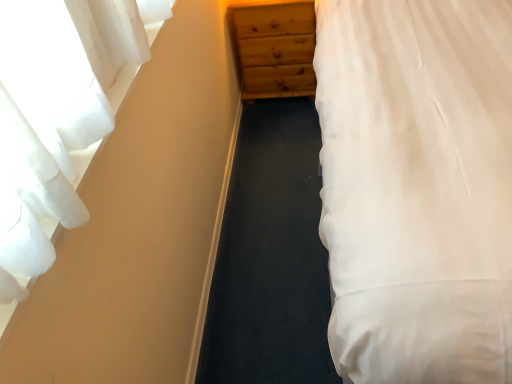
At what (x,y) coordinates should I click in order to perform the action: click on wooden chest of drawers at center. Please return your answer as a coordinate pair (x, y). Looking at the image, I should click on (276, 49).

What do you see at coordinates (417, 188) in the screenshot? I see `white cotton bed at right` at bounding box center [417, 188].

You are a GUI agent. You are given a task and a screenshot of the screen. Output one action in this format:
    pyautogui.click(x=<x>, y=<y>)
    Task: Click on the wooden chest of drawers at center
    The image size is (512, 384).
    Given the screenshot: What is the action you would take?
    pyautogui.click(x=276, y=49)

Which point is more distant from viewer, (287, 54) or (24, 5)?

The point (287, 54) is farther.

Who is bigger, wooden chest of drawers at center or white sheer curtain at left?

With larger size is wooden chest of drawers at center.

Is wooden chest of drawers at center positioned far away from white sheer curtain at left?

Indeed, wooden chest of drawers at center is not near white sheer curtain at left.

Considering the relative sizes of white sheer curtain at left and wooden chest of drawers at center in the image provided, is white sheer curtain at left taller than wooden chest of drawers at center?

No.

Can you confirm if white sheer curtain at left is bigger than wooden chest of drawers at center?

Actually, white sheer curtain at left might be smaller than wooden chest of drawers at center.

From the image's perspective, does white sheer curtain at left appear higher than wooden chest of drawers at center?

No, from the image's perspective, white sheer curtain at left is not on top of wooden chest of drawers at center.

Is white sheer curtain at left positioned far away from wooden chest of drawers at center?

Yes, white sheer curtain at left is far from wooden chest of drawers at center.

From the image's perspective, relative to white cotton bed at right, is white sheer curtain at left above or below?

white sheer curtain at left is situated lower than white cotton bed at right in the image.

Are white sheer curtain at left and white cotton bed at right making contact?

They are not placed beside each other.

Looking at their sizes, would you say white sheer curtain at left is wider or thinner than white cotton bed at right?

In the image, white sheer curtain at left appears to be more narrow than white cotton bed at right.

Does white sheer curtain at left have a smaller size compared to white cotton bed at right?

Indeed, white sheer curtain at left has a smaller size compared to white cotton bed at right.

Is wooden chest of drawers at center spatially inside white cotton bed at right, or outside of it?

wooden chest of drawers at center lies outside white cotton bed at right.

From the image's perspective, relative to white cotton bed at right, is wooden chest of drawers at center above or below?

wooden chest of drawers at center is situated higher than white cotton bed at right in the image.

Can you confirm if wooden chest of drawers at center is smaller than white cotton bed at right?

Yes, wooden chest of drawers at center is smaller than white cotton bed at right.

In order to click on chest of drawers located on the left of white cotton bed at right in this screenshot , I will do `click(276, 49)`.

Is white cotton bed at right outside of wooden chest of drawers at center?

Yes, white cotton bed at right is outside of wooden chest of drawers at center.

Is point (334, 251) more distant than point (286, 63)?

No, (334, 251) is closer to viewer.

Is white cotton bed at right smaller than wooden chest of drawers at center?

No, white cotton bed at right is not smaller than wooden chest of drawers at center.

From the image's perspective, which one is positioned lower, white cotton bed at right or wooden chest of drawers at center?

white cotton bed at right.

Is white cotton bed at right behind white sheer curtain at left?

No.

Is point (365, 97) farther from viewer compared to point (3, 206)?

Yes.

Based on the photo, from a real-world perspective, which is physically below, white cotton bed at right or white sheer curtain at left?

In real-world perspective, white cotton bed at right is lower.

In order to click on curtain that is in front of the wooden chest of drawers at center in this screenshot , I will do `click(42, 129)`.

Where is `the chest of drawers below the white sheer curtain at left (from a real-world perspective)`? the chest of drawers below the white sheer curtain at left (from a real-world perspective) is located at coordinates (276, 49).

Estimate the real-world distances between objects in this image. Which object is further from wooden chest of drawers at center, white cotton bed at right or white sheer curtain at left?

The object further to wooden chest of drawers at center is white sheer curtain at left.

Estimate the real-world distances between objects in this image. Which object is further from white sheer curtain at left, wooden chest of drawers at center or white cotton bed at right?

wooden chest of drawers at center.

Looking at the image, which one is located closer to white cotton bed at right, white sheer curtain at left or wooden chest of drawers at center?

Based on the image, white sheer curtain at left appears to be nearer to white cotton bed at right.

When comparing their distances from wooden chest of drawers at center, does white sheer curtain at left or white cotton bed at right seem closer?

white cotton bed at right.

Estimate the real-world distances between objects in this image. Which object is closer to white sheer curtain at left, white cotton bed at right or wooden chest of drawers at center?

white cotton bed at right is closer to white sheer curtain at left.

Estimate the real-world distances between objects in this image. Which object is further from white cotton bed at right, wooden chest of drawers at center or white sheer curtain at left?

Among the two, wooden chest of drawers at center is located further to white cotton bed at right.

You are a GUI agent. You are given a task and a screenshot of the screen. Output one action in this format:
    pyautogui.click(x=<x>, y=<y>)
    Task: Click on the curtain located between white cotton bed at right and wooden chest of drawers at center in the depth direction
    This screenshot has width=512, height=384.
    Given the screenshot: What is the action you would take?
    pyautogui.click(x=42, y=129)